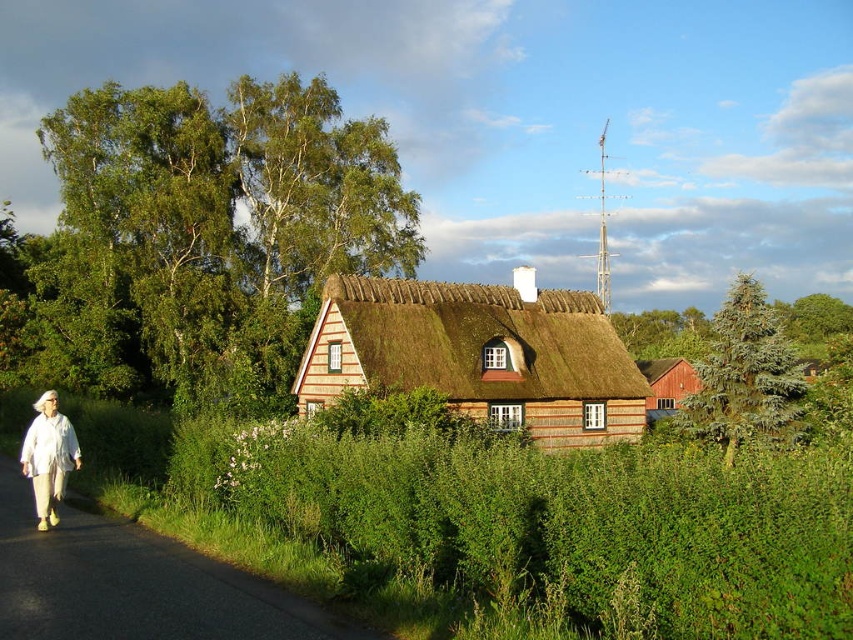
Question: Can you confirm if white fabric pants at left is smaller than red wood barn at center-right?

Choices:
 (A) yes
 (B) no

Answer: (A)

Question: Which object is positioned farthest from the red wood barn at center-right?

Choices:
 (A) green asphalt road at lower left
 (B) white fabric pants at left

Answer: (A)

Question: Which object is farther from the camera taking this photo?

Choices:
 (A) red wood barn at center-right
 (B) green asphalt road at lower left
 (C) brown thatch roof at center

Answer: (A)

Question: Which point is farther to the camera?

Choices:
 (A) (648, 412)
 (B) (55, 458)
 (C) (337, 310)
 (D) (44, 536)

Answer: (A)

Question: Is white fabric pants at left above red wood barn at center-right?

Choices:
 (A) no
 (B) yes

Answer: (B)

Question: Can you confirm if brown thatch roof at center is smaller than red wood barn at center-right?

Choices:
 (A) no
 (B) yes

Answer: (B)